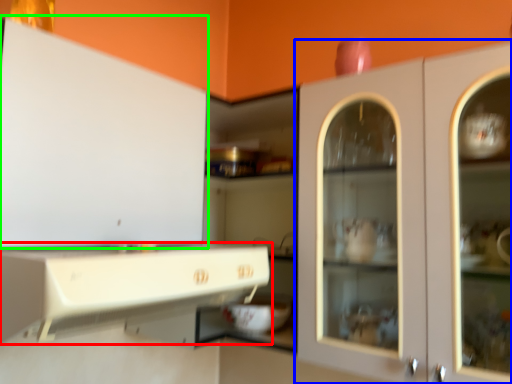
Question: Which is nearer to the cabinetry (highlighted by a red box)? cabinetry (highlighted by a blue box) or cabinetry (highlighted by a green box).

Choices:
 (A) cabinetry
 (B) cabinetry

Answer: (B)